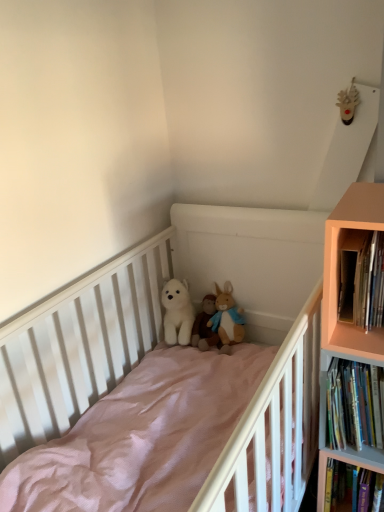
The width and height of the screenshot is (384, 512). I want to click on free spot above pale orange wood bookcase at right (from a real-world perspective), so click(x=364, y=197).